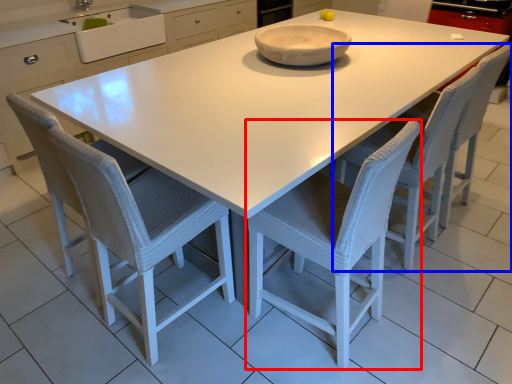
Question: Which object is further to the camera taking this photo, chair (highlighted by a red box) or chair (highlighted by a blue box)?

Choices:
 (A) chair
 (B) chair

Answer: (B)